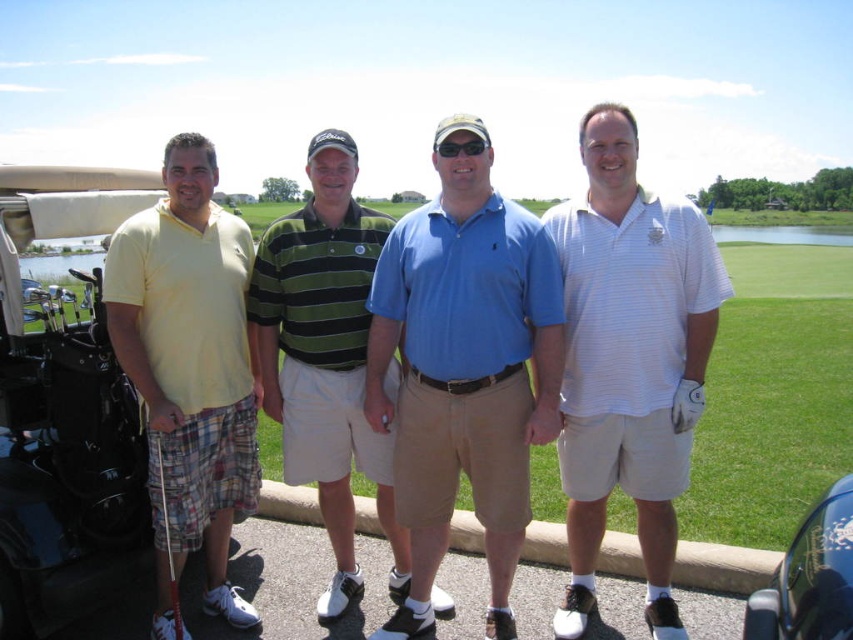
Which of these two, blue cotton polo shirt at center or yellow cotton polo shirt at left, stands taller?

Standing taller between the two is blue cotton polo shirt at center.

Can you confirm if blue cotton polo shirt at center is positioned above yellow cotton polo shirt at left?

Indeed, blue cotton polo shirt at center is positioned over yellow cotton polo shirt at left.

Is point (428, 422) farther from viewer compared to point (184, 520)?

Yes, point (428, 422) is behind point (184, 520).

At what (x,y) coordinates should I click in order to perform the action: click on blue cotton polo shirt at center. Please return your answer as a coordinate pair (x, y). Looking at the image, I should click on (463, 365).

Which is more to the left, matte black golf cart at left or green striped polo shirt at center?

matte black golf cart at left is more to the left.

Can you confirm if matte black golf cart at left is positioned to the right of green striped polo shirt at center?

No, matte black golf cart at left is not to the right of green striped polo shirt at center.

You are a GUI agent. You are given a task and a screenshot of the screen. Output one action in this format:
    pyautogui.click(x=<x>, y=<y>)
    Task: Click on the matte black golf cart at left
    This screenshot has width=853, height=640.
    Given the screenshot: What is the action you would take?
    coord(62,403)

The image size is (853, 640). Find the location of `matte black golf cart at left`. matte black golf cart at left is located at coordinates (62, 403).

Who is lower down, blue cotton polo shirt at center or matte black golf cart at left?

blue cotton polo shirt at center

Does point (381, 346) lie behind point (21, 554)?

Yes.

You are a GUI agent. You are given a task and a screenshot of the screen. Output one action in this format:
    pyautogui.click(x=<x>, y=<y>)
    Task: Click on the blue cotton polo shirt at center
    
    Given the screenshot: What is the action you would take?
    pyautogui.click(x=463, y=365)